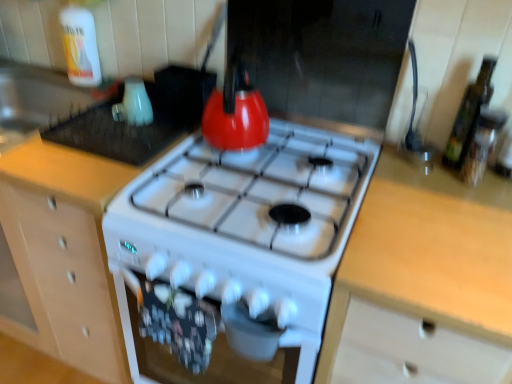
Find the location of a particular element. vacant space situated above light wood countertop at right (from a real-world perspective) is located at coordinates (450, 225).